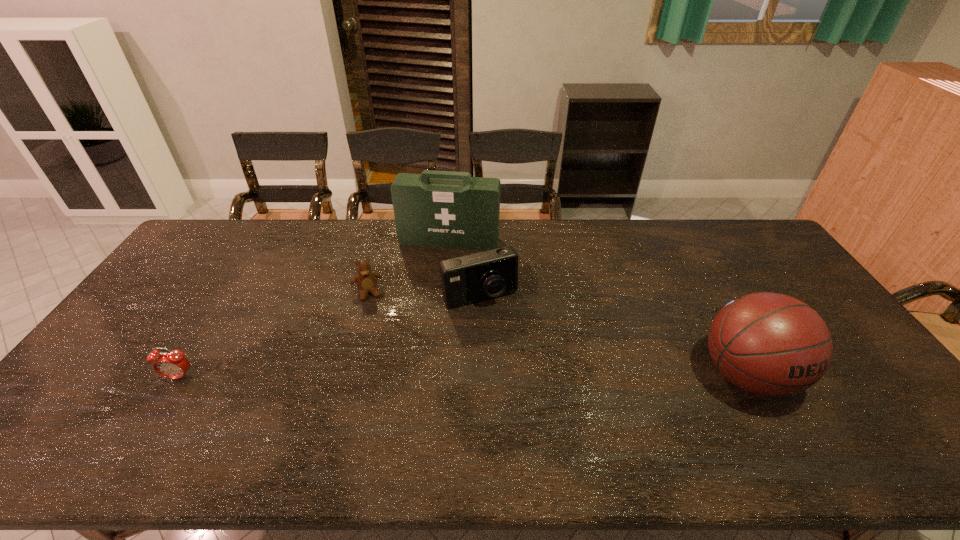
At what (x,y) coordinates should I click in order to perform the action: click on vacant space on the desktop that is between the alarm clock and the rightmost object and is positioned at the face of the second object from left to right. Please return your answer as a coordinate pair (x, y). Image resolution: width=960 pixels, height=540 pixels. Looking at the image, I should click on (387, 376).

Identify the location of free space on the desktop that is between the alarm clock and the rightmost object and is positioned on the front-facing side of the farthest object. This screenshot has height=540, width=960. (412, 376).

What are the coordinates of `vacant space on the desktop that is between the leftmost object and the basketball and is positioned on the front-facing side of the third shortest object` in the screenshot? It's located at (516, 376).